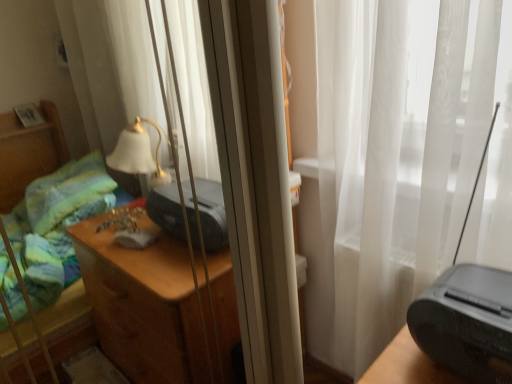
Question: Is black plastic printer at right, which is the 1th printer from right to left, at the right side of matte black printer at center, arranged as the 2th printer when viewed from the right?

Choices:
 (A) no
 (B) yes

Answer: (B)

Question: From a real-world perspective, is black plastic printer at right, the 2th printer from the left, on matte black printer at center, arranged as the 2th printer when viewed from the right?

Choices:
 (A) no
 (B) yes

Answer: (B)

Question: From the image's perspective, would you say black plastic printer at right, the 2th printer from the left, is positioned over matte black printer at center, arranged as the 2th printer when viewed from the right?

Choices:
 (A) yes
 (B) no

Answer: (B)

Question: Can you confirm if black plastic printer at right, which is the 1th printer from right to left, is bigger than matte black printer at center, which is the 1th printer in back-to-front order?

Choices:
 (A) yes
 (B) no

Answer: (A)

Question: Considering the relative sizes of black plastic printer at right, positioned as the second printer in back-to-front order, and matte black printer at center, which is the 1th printer in back-to-front order, in the image provided, is black plastic printer at right, positioned as the second printer in back-to-front order, shorter than matte black printer at center, which is the 1th printer in back-to-front order,?

Choices:
 (A) yes
 (B) no

Answer: (A)

Question: Could you tell me if black plastic printer at right, the 2th printer from the left, is turned towards matte black printer at center, positioned as the 1th printer in left-to-right order?

Choices:
 (A) yes
 (B) no

Answer: (B)

Question: Is black plastic radio at right next to matte black printer at center, which is the 1th printer in back-to-front order, and touching it?

Choices:
 (A) no
 (B) yes

Answer: (A)

Question: Is black plastic radio at right thinner than matte black printer at center, which is the 1th printer in back-to-front order?

Choices:
 (A) no
 (B) yes

Answer: (A)

Question: Does black plastic radio at right appear on the right side of matte black printer at center, arranged as the second printer when viewed from the front?

Choices:
 (A) yes
 (B) no

Answer: (A)

Question: Could matte black printer at center, arranged as the second printer when viewed from the front, be considered to be inside black plastic radio at right?

Choices:
 (A) no
 (B) yes

Answer: (A)

Question: Is black plastic radio at right shorter than matte black printer at center, arranged as the 2th printer when viewed from the right?

Choices:
 (A) yes
 (B) no

Answer: (B)

Question: Is black plastic radio at right further to camera compared to matte black printer at center, arranged as the 2th printer when viewed from the right?

Choices:
 (A) no
 (B) yes

Answer: (A)

Question: Is matte black printer at center, arranged as the 2th printer when viewed from the right, located outside black plastic radio at right?

Choices:
 (A) yes
 (B) no

Answer: (A)